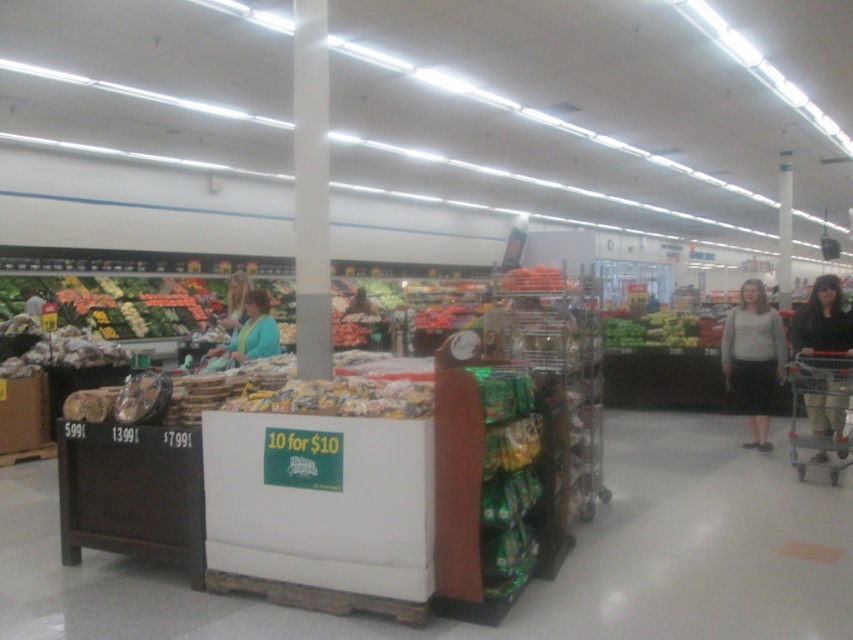
Question: Which point is closer to the camera?

Choices:
 (A) (270, 344)
 (B) (809, 401)
 (C) (753, 312)

Answer: (A)

Question: Observing the image, what is the correct spatial positioning of light gray sweater at right in reference to metallic silver shopping cart at lower right?

Choices:
 (A) left
 (B) right

Answer: (B)

Question: Among these points, which one is nearest to the camera?

Choices:
 (A) (257, 317)
 (B) (811, 364)
 (C) (764, 444)

Answer: (A)

Question: Can you confirm if light gray sweater at right is wider than metallic silver shopping cart at lower right?

Choices:
 (A) no
 (B) yes

Answer: (B)

Question: Among these objects, which one is farthest from the camera?

Choices:
 (A) metallic silver shopping cart at lower right
 (B) teal fabric jacket at center

Answer: (A)

Question: Can you confirm if light gray sweater at right is thinner than teal fabric jacket at center?

Choices:
 (A) no
 (B) yes

Answer: (A)